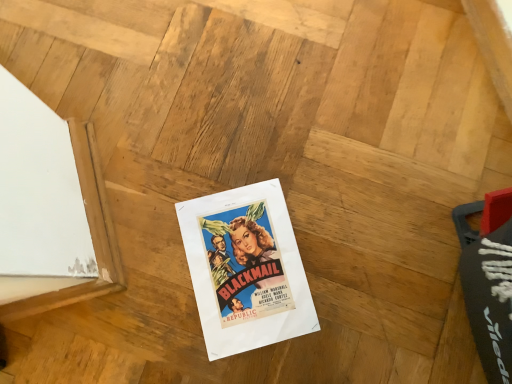
What do you see at coordinates (246, 269) in the screenshot?
I see `matte paper poster at center` at bounding box center [246, 269].

Locate an element on the screen. matte paper poster at center is located at coordinates (246, 269).

In order to face matte paper poster at center, should I rotate leftwards or rightwards?

To align with it, rotate left about 1.341°.

Find the location of `matte paper poster at center`. matte paper poster at center is located at coordinates (246, 269).